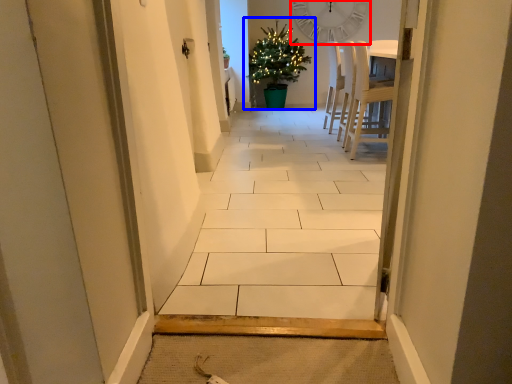
Question: Among these objects, which one is farthest to the camera, clock (highlighted by a red box) or houseplant (highlighted by a blue box)?

Choices:
 (A) clock
 (B) houseplant

Answer: (A)